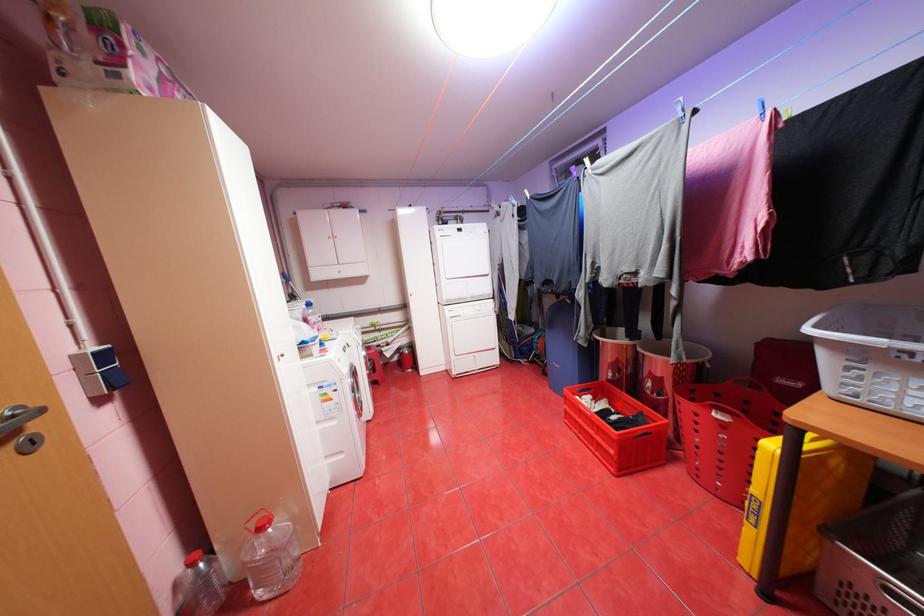
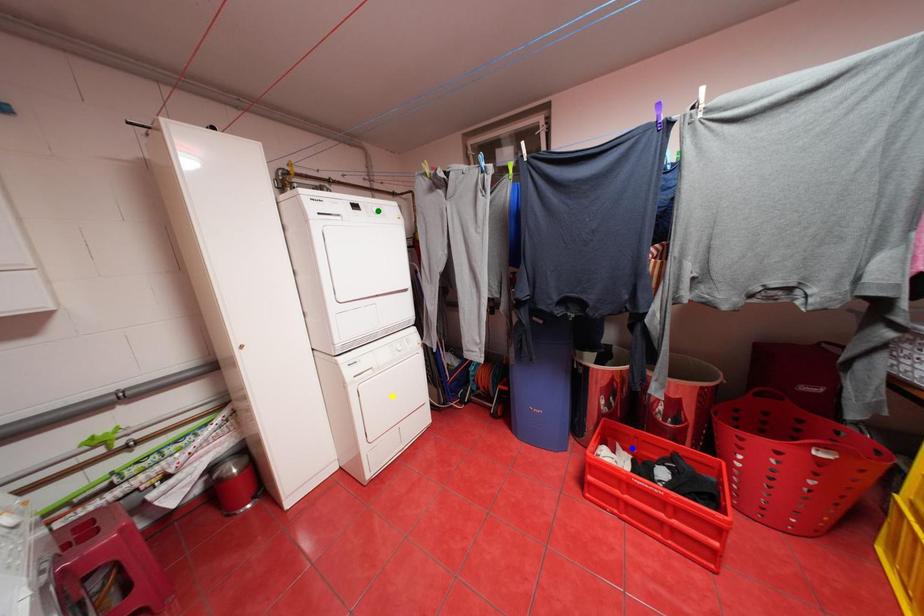
Question: I am providing you with two images of the same scene from different viewpoints. A red point is marked on the first image. You are given multiple points on the second image. Which point in image 2 is actually the same real-world point as the red point in image 1?

Choices:
 (A) yellow point
 (B) blue point
 (C) green point

Answer: (B)